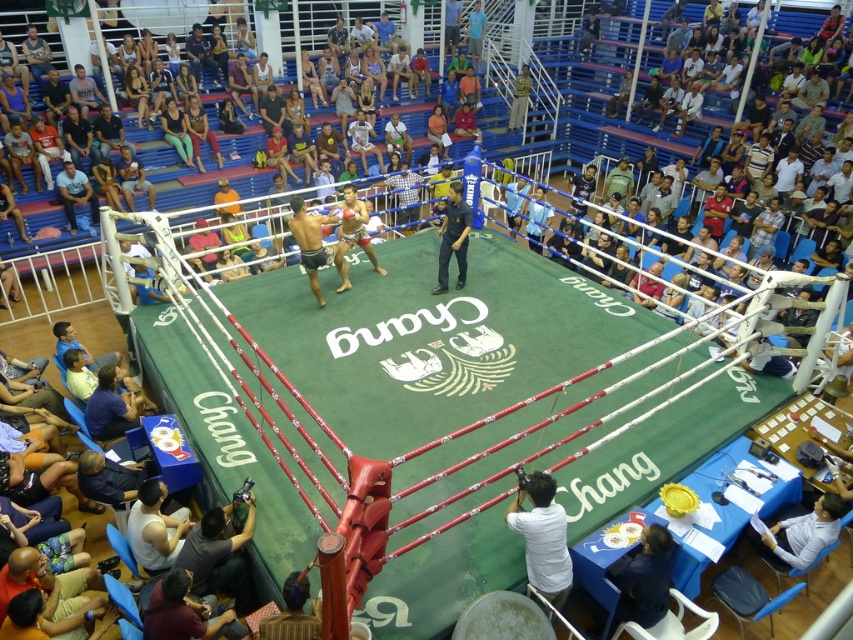
Question: Can you confirm if dark gray fabric at lower left is thinner than dark blue jeans at center?

Choices:
 (A) yes
 (B) no

Answer: (B)

Question: Which of the following is the closest to the observer?

Choices:
 (A) matte blue shirt at left
 (B) dark gray fabric at lower left
 (C) dark blue jeans at center

Answer: (B)

Question: Does dark gray fabric at lower left lie behind matte blue shirt at left?

Choices:
 (A) yes
 (B) no

Answer: (B)

Question: Which of the following is the farthest from the observer?

Choices:
 (A) (440, 273)
 (B) (209, 515)

Answer: (A)

Question: Considering the real-world distances, which object is closest to the matte blue shirt at left?

Choices:
 (A) dark gray fabric at lower left
 (B) dark blue jeans at center

Answer: (B)

Question: Where is dark gray fabric at lower left located in relation to matte blue shirt at left in the image?

Choices:
 (A) right
 (B) left

Answer: (A)